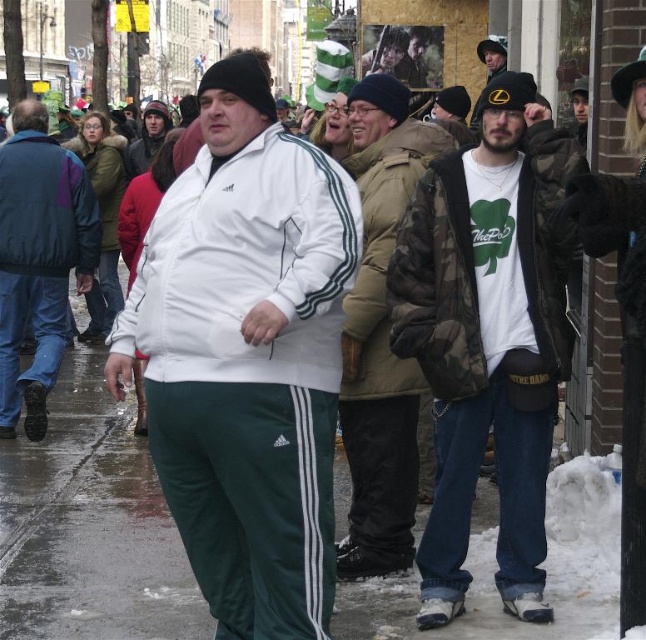
Question: Is camouflage jacket at center above dark green textured jacket at left?

Choices:
 (A) yes
 (B) no

Answer: (B)

Question: Among these points, which one is farthest from the camera?

Choices:
 (A) (380, 211)
 (B) (32, 147)
 (C) (158, 268)
 (D) (202, 358)

Answer: (B)

Question: Is green track pants at center to the left of dark blue and green quilted jacket at left from the viewer's perspective?

Choices:
 (A) no
 (B) yes

Answer: (A)

Question: Which of the following is the closest to the observer?

Choices:
 (A) (616, 577)
 (B) (17, 131)

Answer: (A)

Question: Can you confirm if white matte tracksuit at center is positioned to the right of matte white jacket at center?

Choices:
 (A) no
 (B) yes

Answer: (B)

Question: Which of the following is the farthest from the observer?

Choices:
 (A) (344, 275)
 (B) (36, 157)
 (C) (63, 212)
 (D) (39, 522)

Answer: (B)